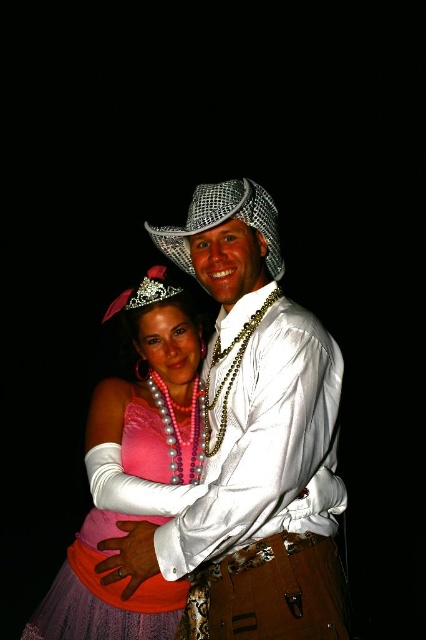
Between satin white shirt at center and glittery metallic cowboy hat at center, which one has more height?

With more height is satin white shirt at center.

Who is positioned more to the right, satin white shirt at center or glittery metallic cowboy hat at center?

glittery metallic cowboy hat at center is more to the right.

Locate an element on the screen. satin white shirt at center is located at coordinates (215, 465).

Measure the distance from pink satin dress at center to glittery metallic cowboy hat at center.

51.75 centimeters

At what (x,y) coordinates should I click in order to perform the action: click on pink satin dress at center. Please return your answer as a coordinate pair (x, y). The image size is (426, 640). Looking at the image, I should click on (135, 472).

Locate an element on the screen. satin white shirt at center is located at coordinates (215, 465).

Does point (293, 408) come closer to viewer compared to point (155, 445)?

Yes, it is.

Identify the location of satin white shirt at center. (215, 465).